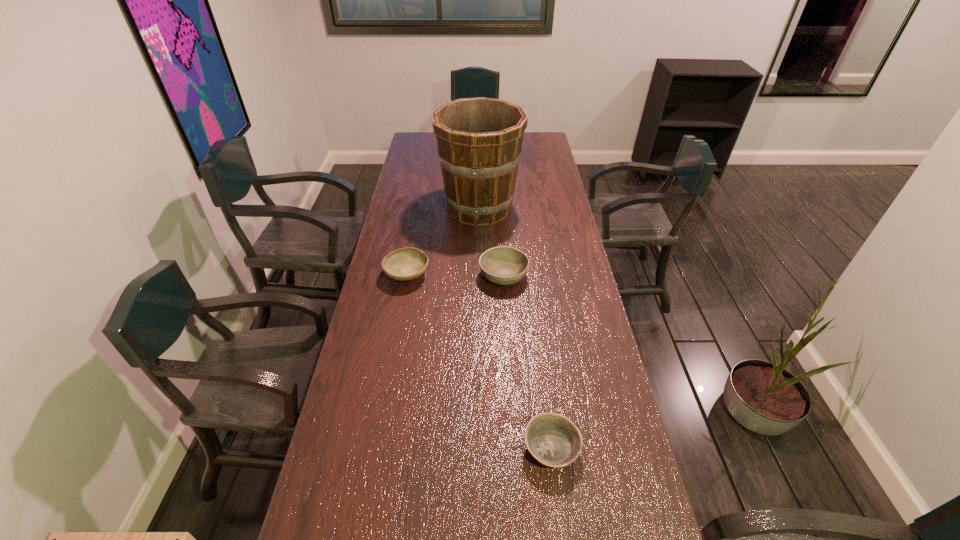
Identify the location of free region at the left edge of the desktop. This screenshot has width=960, height=540. (419, 156).

Image resolution: width=960 pixels, height=540 pixels. I want to click on free space at the right edge of the desktop, so click(x=564, y=226).

Where is `vacant space at the far left corner of the desktop`? Image resolution: width=960 pixels, height=540 pixels. vacant space at the far left corner of the desktop is located at coordinates (423, 132).

Where is `vacant space at the far right corner of the desktop`? vacant space at the far right corner of the desktop is located at coordinates coord(549,144).

Where is `empty space that is in between the nearest object and the leftmost bowl`? This screenshot has width=960, height=540. empty space that is in between the nearest object and the leftmost bowl is located at coordinates (479, 361).

Locate an element on the screen. unoccupied position between the leftmost bowl and the nearest bowl is located at coordinates (x=479, y=361).

At what (x,y) coordinates should I click in order to perform the action: click on empty space between the farthest object and the shortest bowl. Please return your answer as a coordinate pair (x, y). Image resolution: width=960 pixels, height=540 pixels. Looking at the image, I should click on (516, 328).

Identify the location of empty space between the leftmost bowl and the tallest object. Image resolution: width=960 pixels, height=540 pixels. point(444,241).

You are a GUI agent. You are given a task and a screenshot of the screen. Output one action in this format:
    pyautogui.click(x=<x>, y=<y>)
    Task: Click on the vacant region between the tallest object and the leftmost bowl
    This screenshot has width=960, height=540.
    Given the screenshot: What is the action you would take?
    [444, 241]

Locate an element on the screen. Image resolution: width=960 pixels, height=540 pixels. free space between the bucket and the leftmost bowl is located at coordinates (444, 241).